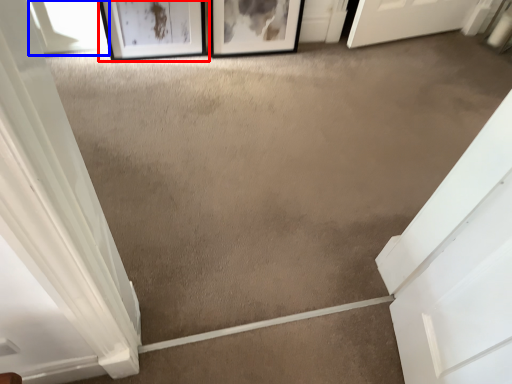
Question: Which of the following is the closest to the observer, picture frame (highlighted by a red box) or window (highlighted by a blue box)?

Choices:
 (A) picture frame
 (B) window

Answer: (A)